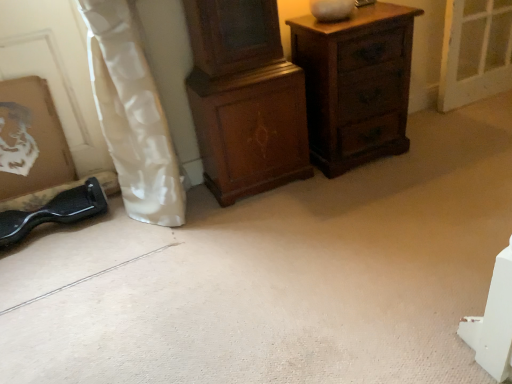
Question: From the image's perspective, would you say wooden picture frame at lower left is shown under wooden chest of drawers at upper right, the first chest of drawers in the right-to-left sequence?

Choices:
 (A) yes
 (B) no

Answer: (A)

Question: Could you tell me if wooden picture frame at lower left is turned towards wooden chest of drawers at upper right, which appears as the 2th chest of drawers when viewed from the left?

Choices:
 (A) yes
 (B) no

Answer: (B)

Question: Can you confirm if wooden picture frame at lower left is smaller than wooden chest of drawers at upper right, which appears as the 2th chest of drawers when viewed from the left?

Choices:
 (A) no
 (B) yes

Answer: (B)

Question: From a real-world perspective, is wooden picture frame at lower left over wooden chest of drawers at upper right, which appears as the 2th chest of drawers when viewed from the left?

Choices:
 (A) no
 (B) yes

Answer: (B)

Question: Would you say wooden picture frame at lower left contains wooden chest of drawers at upper right, the first chest of drawers in the right-to-left sequence?

Choices:
 (A) no
 (B) yes

Answer: (A)

Question: Is wooden chest of drawers at upper right, which appears as the 2th chest of drawers when viewed from the left, at the back of wooden picture frame at lower left?

Choices:
 (A) no
 (B) yes

Answer: (A)

Question: Is white glossy curtain at left thinner than wooden picture frame at lower left?

Choices:
 (A) yes
 (B) no

Answer: (B)

Question: Considering the relative sizes of white glossy curtain at left and wooden picture frame at lower left in the image provided, is white glossy curtain at left smaller than wooden picture frame at lower left?

Choices:
 (A) yes
 (B) no

Answer: (B)

Question: Is white glossy curtain at left located outside wooden picture frame at lower left?

Choices:
 (A) no
 (B) yes

Answer: (B)

Question: Considering the relative sizes of white glossy curtain at left and wooden picture frame at lower left in the image provided, is white glossy curtain at left shorter than wooden picture frame at lower left?

Choices:
 (A) yes
 (B) no

Answer: (B)

Question: Can you see white glossy curtain at left touching wooden picture frame at lower left?

Choices:
 (A) yes
 (B) no

Answer: (B)

Question: Does white glossy curtain at left turn towards wooden picture frame at lower left?

Choices:
 (A) no
 (B) yes

Answer: (A)

Question: Would you say wooden cabinet at center, positioned as the first chest of drawers in left-to-right order, contains white glossy curtain at left?

Choices:
 (A) no
 (B) yes

Answer: (A)